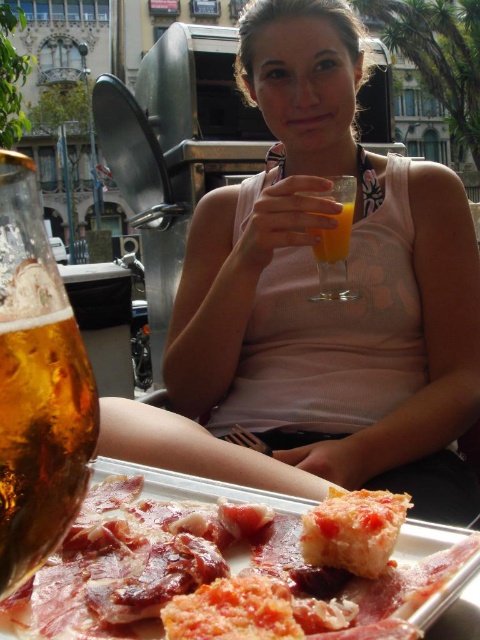
Question: Is pink fabric dress at center to the right of translucent glass at upper center from the viewer's perspective?

Choices:
 (A) no
 (B) yes

Answer: (A)

Question: Does translucent amber liquid at lower left have a lesser width compared to transparent glass at center?

Choices:
 (A) no
 (B) yes

Answer: (B)

Question: Which object is the closest to the translucent glass at upper center?

Choices:
 (A) pink fabric dress at center
 (B) transparent glass at center

Answer: (B)

Question: Which is farther from the transparent glass at center?

Choices:
 (A) translucent amber liquid at lower left
 (B) golden crispy bread at lower center

Answer: (B)

Question: Which point is closer to the camera?

Choices:
 (A) transparent glass at center
 (B) translucent glass at upper center
 (C) pink fabric dress at center
 (D) translucent amber liquid at lower left

Answer: (D)

Question: Can you confirm if transparent glass at center is bigger than translucent glass at upper center?

Choices:
 (A) no
 (B) yes

Answer: (B)